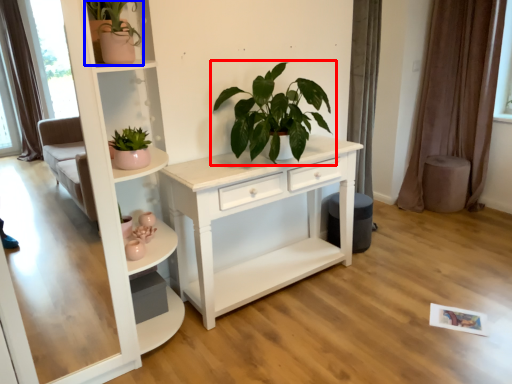
Question: Which point is closer to the camera, houseplant (highlighted by a red box) or houseplant (highlighted by a blue box)?

Choices:
 (A) houseplant
 (B) houseplant

Answer: (B)